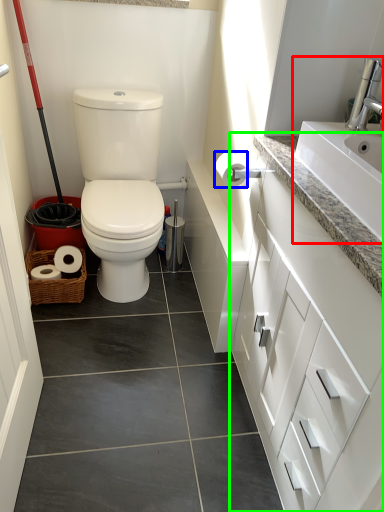
Question: Considering the real-world distances, which object is closest to sink (highlighted by a red box)? toilet paper (highlighted by a blue box) or bathroom cabinet (highlighted by a green box).

Choices:
 (A) toilet paper
 (B) bathroom cabinet

Answer: (B)